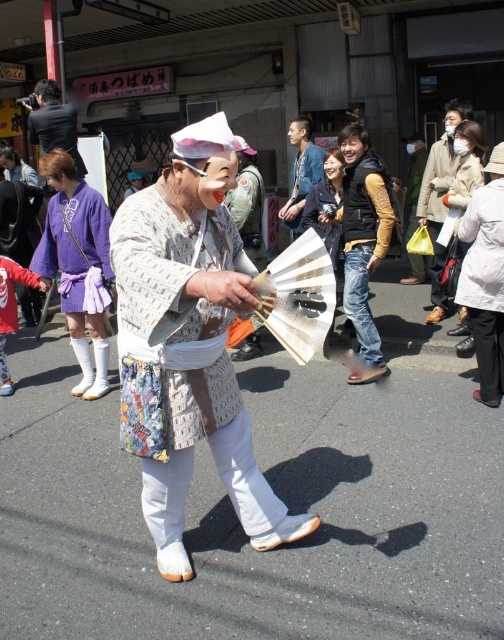
Question: Estimate the real-world distances between objects in this image. Which object is farther from the matte white fan at center?

Choices:
 (A) white cotton kimono at center
 (B) denim jeans at center
 (C) purple fabric kimono at left

Answer: (A)

Question: Which object appears closest to the camera in this image?

Choices:
 (A) purple fabric kimono at left
 (B) denim jeans at center
 (C) white cotton kimono at center
 (D) matte white fan at center

Answer: (C)

Question: Which object appears closest to the camera in this image?

Choices:
 (A) denim jeans at center
 (B) matte white fan at center

Answer: (A)

Question: Is white cotton kimono at center to the right of matte white fan at center from the viewer's perspective?

Choices:
 (A) yes
 (B) no

Answer: (B)

Question: Can you confirm if purple fabric kimono at left is bigger than matte white fan at center?

Choices:
 (A) no
 (B) yes

Answer: (A)

Question: Is purple fabric kimono at left to the left of denim jeans at center from the viewer's perspective?

Choices:
 (A) yes
 (B) no

Answer: (A)